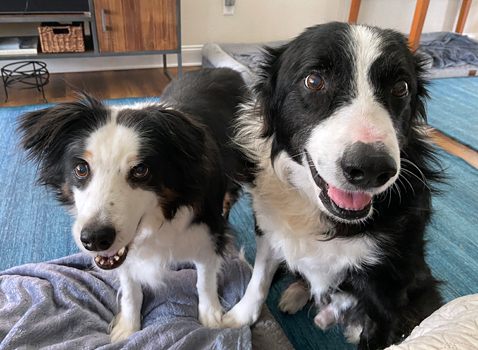
Where is `gray blanket`? The image size is (478, 350). gray blanket is located at coordinates (36, 303).